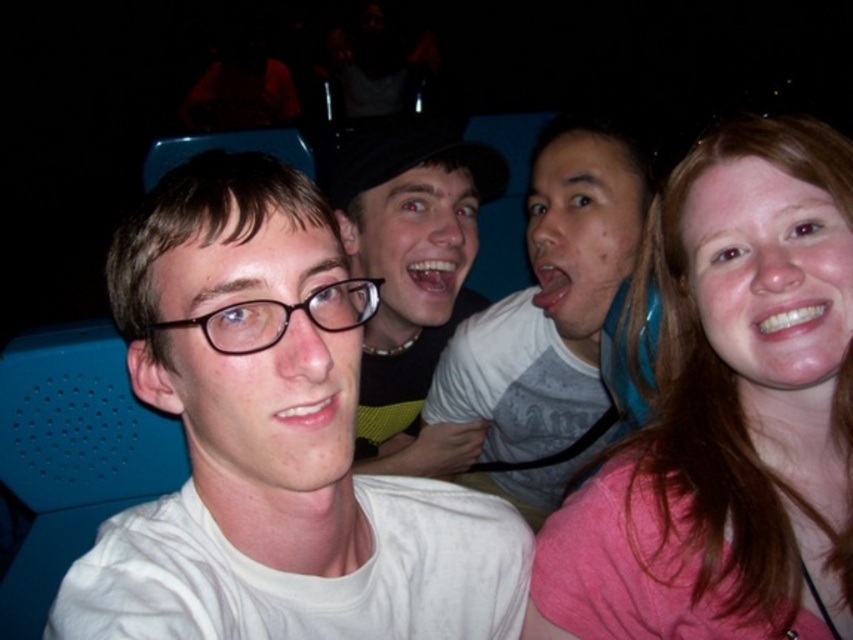
Question: Does white matte t-shirt at center have a greater width compared to matte black hat at center?

Choices:
 (A) yes
 (B) no

Answer: (A)

Question: Can you confirm if gray matte shirt at center is wider than matte black hat at center?

Choices:
 (A) no
 (B) yes

Answer: (B)

Question: Which of these objects is positioned farthest from the pink fabric shirt at right?

Choices:
 (A) gray matte shirt at center
 (B) matte black hat at center

Answer: (B)

Question: Among these points, which one is nearest to the camera?

Choices:
 (A) (540, 192)
 (B) (479, 433)

Answer: (A)

Question: Is white matte t-shirt at center to the right of gray matte shirt at center from the viewer's perspective?

Choices:
 (A) yes
 (B) no

Answer: (B)

Question: Which point is farther to the camera?

Choices:
 (A) (560, 625)
 (B) (294, 454)

Answer: (A)